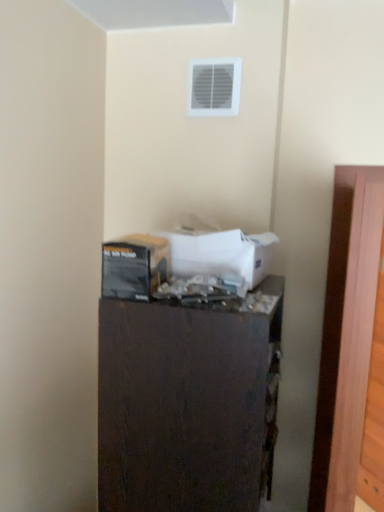
Question: Is dark wood dresser at center positioned behind white cardboard box at center, which is counted as the first box, starting from the right?

Choices:
 (A) yes
 (B) no

Answer: (B)

Question: From the image's perspective, is dark wood dresser at center located beneath white cardboard box at center, the second box from the left?

Choices:
 (A) yes
 (B) no

Answer: (A)

Question: Is dark wood dresser at center wider than white cardboard box at center, the second box from the left?

Choices:
 (A) no
 (B) yes

Answer: (B)

Question: Is dark wood dresser at center oriented towards white cardboard box at center, the second box from the left?

Choices:
 (A) yes
 (B) no

Answer: (B)

Question: Considering the relative positions of dark wood dresser at center and white cardboard box at center, the second box from the left, in the image provided, is dark wood dresser at center to the left of white cardboard box at center, the second box from the left, from the viewer's perspective?

Choices:
 (A) yes
 (B) no

Answer: (A)

Question: From a real-world perspective, is dark wood dresser at center physically below white cardboard box at center, which is counted as the first box, starting from the right?

Choices:
 (A) no
 (B) yes

Answer: (B)

Question: Considering the relative sizes of dark wood dresser at center and white plastic vent at upper center in the image provided, is dark wood dresser at center taller than white plastic vent at upper center?

Choices:
 (A) no
 (B) yes

Answer: (B)

Question: Are dark wood dresser at center and white plastic vent at upper center far apart?

Choices:
 (A) yes
 (B) no

Answer: (B)

Question: Is dark wood dresser at center wider than white plastic vent at upper center?

Choices:
 (A) no
 (B) yes

Answer: (B)

Question: Is dark wood dresser at center positioned before white plastic vent at upper center?

Choices:
 (A) yes
 (B) no

Answer: (A)

Question: Is dark wood dresser at center not within white plastic vent at upper center?

Choices:
 (A) yes
 (B) no

Answer: (A)

Question: Is dark wood dresser at center facing away from white plastic vent at upper center?

Choices:
 (A) no
 (B) yes

Answer: (A)

Question: Is dark wood dresser at center next to wooden at right and touching it?

Choices:
 (A) no
 (B) yes

Answer: (A)